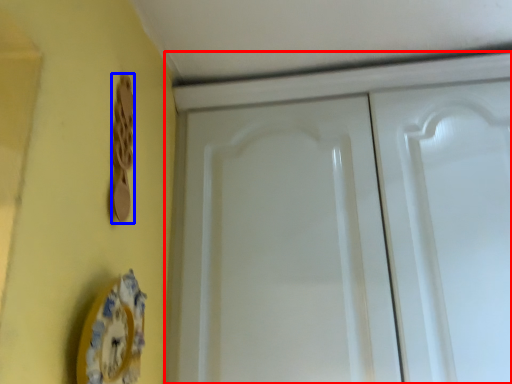
Question: Which object is closer to the camera taking this photo, cabinetry (highlighted by a red box) or door handle (highlighted by a blue box)?

Choices:
 (A) cabinetry
 (B) door handle

Answer: (B)